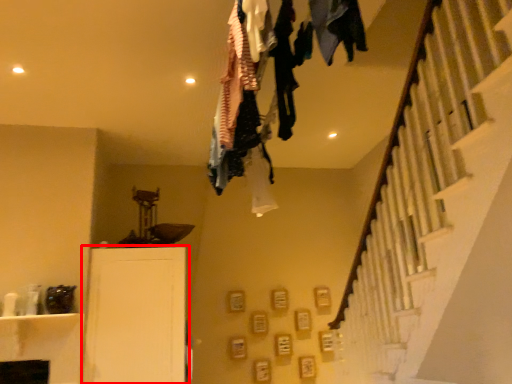
Question: From the image, what is the correct spatial relationship of furniture (annotated by the red box) in relation to clothing?

Choices:
 (A) left
 (B) right

Answer: (A)